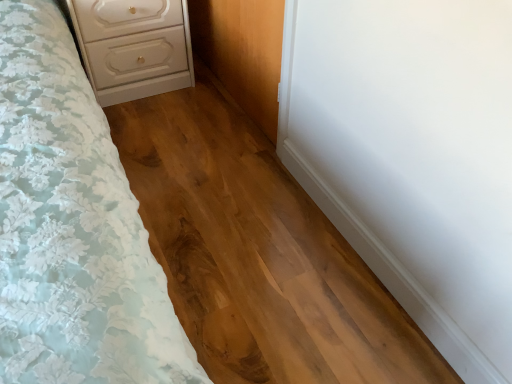
Find the location of a particular element. vacant space in front of white glossy chest of drawers at upper left is located at coordinates (156, 122).